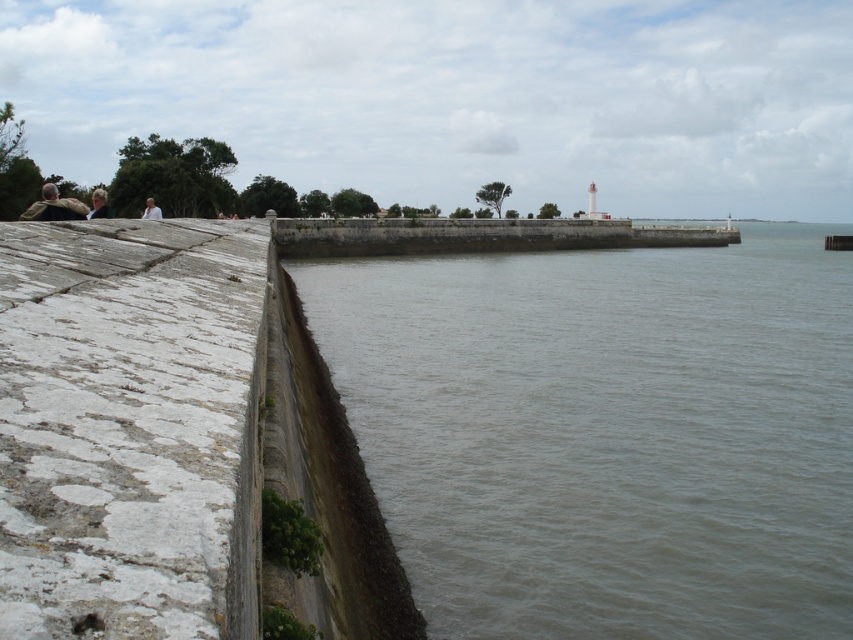
Based on the photo, you are standing on the stone walkway and see the camouflage jacket at left. Where exactly is it located in relation to the stone wall?

The camouflage jacket at left is located at point (54, 205) relative to the stone wall.

You are standing on the stone walkway and see the camouflage jacket at left and the white fabric at upper left. Which object is positioned more to the left side of the scene?

The camouflage jacket at left is positioned more to the left side of the scene than the white fabric at upper left.

You are a photographer trying to capture a person wearing a camouflage jacket at left and someone with light brown hair at upper left in the same frame. Based on their sizes, which object would appear closer to the camera?

The camouflage jacket at left is bigger than the light brown hair at upper left, so the camouflage jacket at left would appear closer to the camera since larger objects in the frame typically indicate proximity to the viewer.